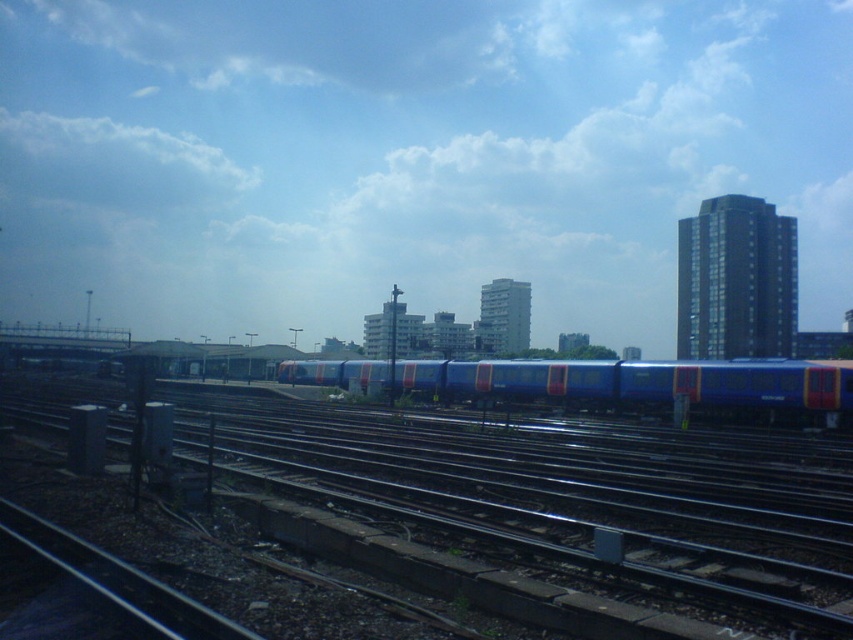
Is point (688, 454) farther from camera compared to point (782, 378)?

No, it is in front of (782, 378).

How far apart are metallic tracks at center and blue metallic train at center?

metallic tracks at center is 13.96 meters from blue metallic train at center.

Between point (805, 436) and point (791, 420), which one is positioned behind?

The point (791, 420) is behind.

I want to click on metallic tracks at center, so click(x=572, y=499).